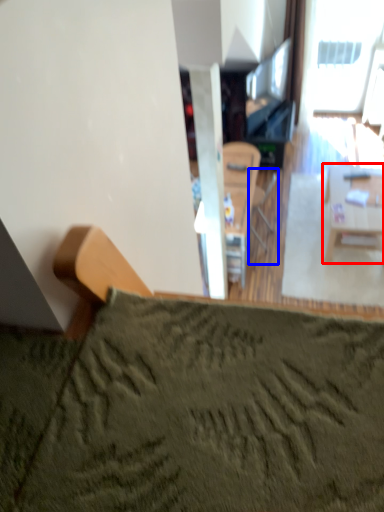
Question: Among these objects, which one is nearest to the camera, table (highlighted by a red box) or armchair (highlighted by a blue box)?

Choices:
 (A) table
 (B) armchair

Answer: (A)